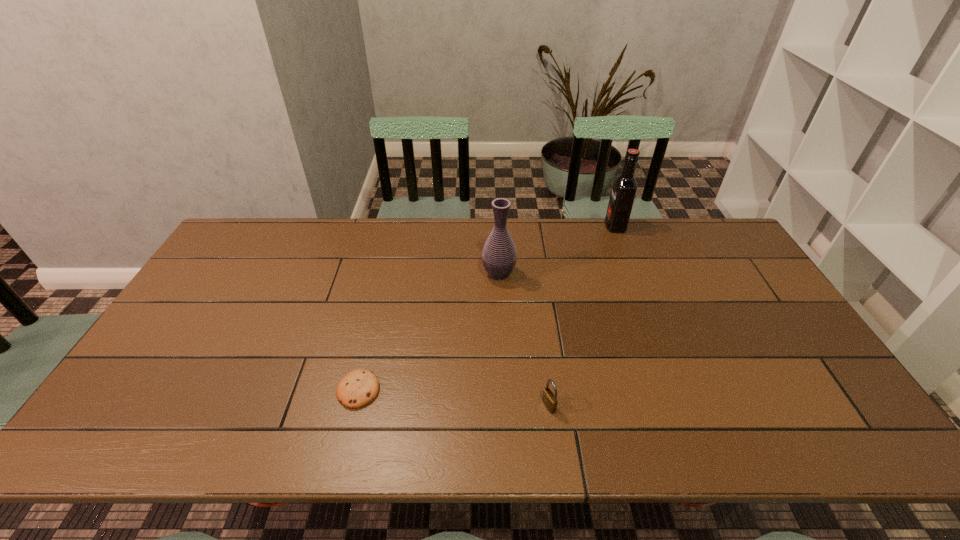
The height and width of the screenshot is (540, 960). Find the location of `vacant space at the far left corner of the desktop`. vacant space at the far left corner of the desktop is located at coordinates (283, 226).

Identify the location of free spot at the far right corner of the desktop. (733, 258).

Where is `vacant area between the rightmost object and the cookie`? This screenshot has height=540, width=960. vacant area between the rightmost object and the cookie is located at coordinates (487, 308).

Locate an element on the screen. This screenshot has width=960, height=540. unoccupied area between the second farthest object and the farthest object is located at coordinates (557, 250).

Find the location of a particular element. The height and width of the screenshot is (540, 960). free area in between the farthest object and the second farthest object is located at coordinates click(557, 250).

Where is `blank region between the vase and the second shortest object`? The image size is (960, 540). blank region between the vase and the second shortest object is located at coordinates (524, 340).

Identify the location of free spot between the padlock and the rightmost object. (582, 316).

Where is `unoccupied area between the farthest object and the padlock`? The image size is (960, 540). unoccupied area between the farthest object and the padlock is located at coordinates coord(582,316).

Locate an element on the screen. Image resolution: width=960 pixels, height=540 pixels. empty space between the vase and the farthest object is located at coordinates (557, 250).

Find the location of a particular element. unoccupied area between the vase and the liquor is located at coordinates (557, 250).